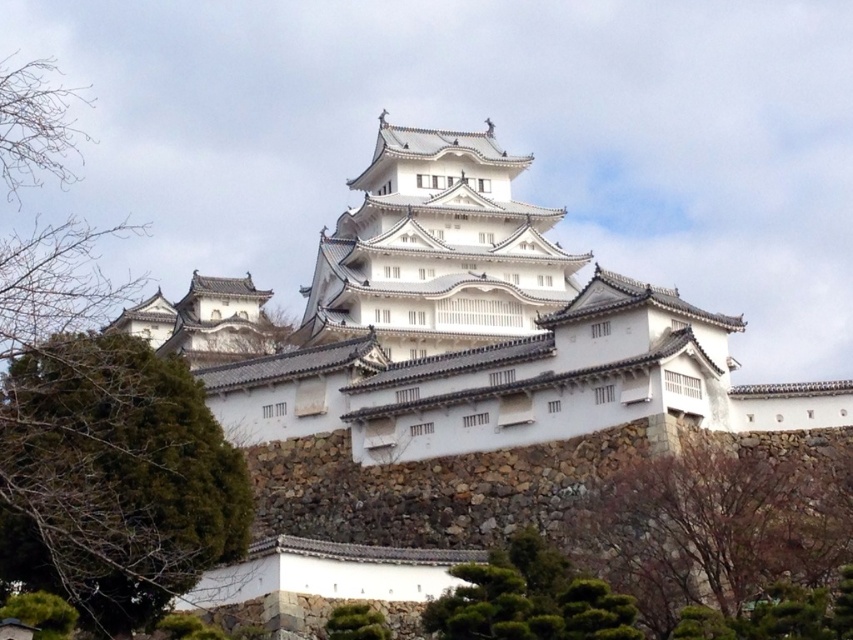
Question: Can you confirm if white stone castle at center is positioned below green leafy tree at lower center?

Choices:
 (A) no
 (B) yes

Answer: (A)

Question: Which is nearer to the green mossy rock at lower center?

Choices:
 (A) white smooth castle at center
 (B) brown textured tree at lower right
 (C) green leafy tree at center

Answer: (C)

Question: Can you confirm if white smooth castle at center is bigger than green leafy tree at lower center?

Choices:
 (A) no
 (B) yes

Answer: (B)

Question: Estimate the real-world distances between objects in this image. Which object is farther from the green mossy rock at lower center?

Choices:
 (A) brown textured tree at lower right
 (B) green leafy tree at center
 (C) white stone castle at center

Answer: (C)

Question: Based on their relative distances, which object is farther from the green leafy tree at lower center?

Choices:
 (A) green leafy tree at center
 (B) brown textured tree at lower right
 (C) white stone castle at center
 (D) white smooth castle at center

Answer: (D)

Question: Is white stone castle at center closer to camera compared to white smooth castle at center?

Choices:
 (A) yes
 (B) no

Answer: (A)